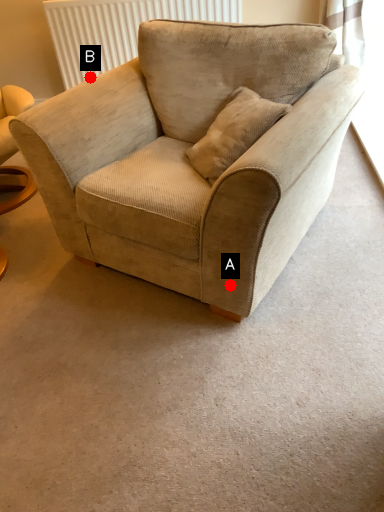
Question: Two points are circled on the image, labeled by A and B beside each circle. Which of the following is the farthest from the observer?

Choices:
 (A) A is further
 (B) B is further

Answer: (B)